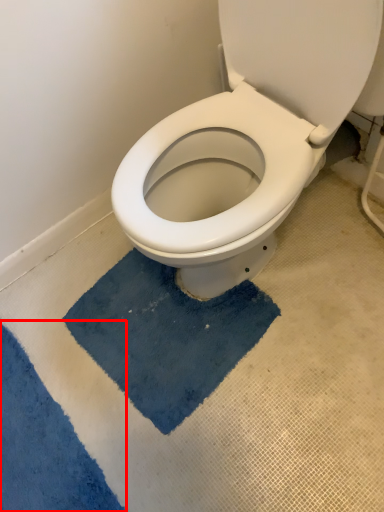
Question: From the image, what is the correct spatial relationship of bath mat (annotated by the red box) in relation to bath mat?

Choices:
 (A) left
 (B) right

Answer: (A)